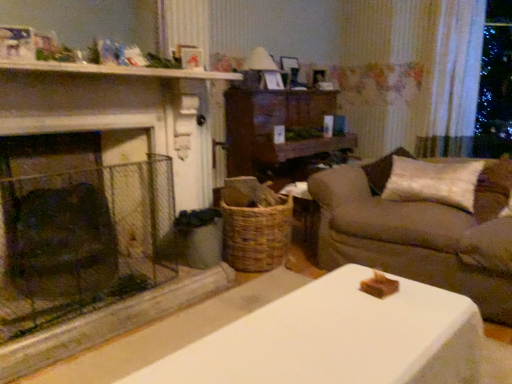
Question: From the image's perspective, is woven brown basket at center above or below matte white lampshade at upper center?

Choices:
 (A) above
 (B) below

Answer: (B)

Question: From a real-world perspective, is woven brown basket at center positioned above or below matte white lampshade at upper center?

Choices:
 (A) below
 (B) above

Answer: (A)

Question: Based on their relative distances, which object is nearer to the woven brown basket at center?

Choices:
 (A) matte white lampshade at upper center
 (B) white painted wood mantle at upper center
 (C) white sheer curtain at upper right
 (D) velvet beige pillow at right
 (E) beige fabric couch at right

Answer: (E)

Question: Estimate the real-world distances between objects in this image. Which object is farther from the white sheer curtain at upper right?

Choices:
 (A) woven brown basket at center
 (B) white painted wood mantle at upper center
 (C) velvet beige pillow at right
 (D) dark stone fireplace at left
 (E) beige fabric couch at right

Answer: (D)